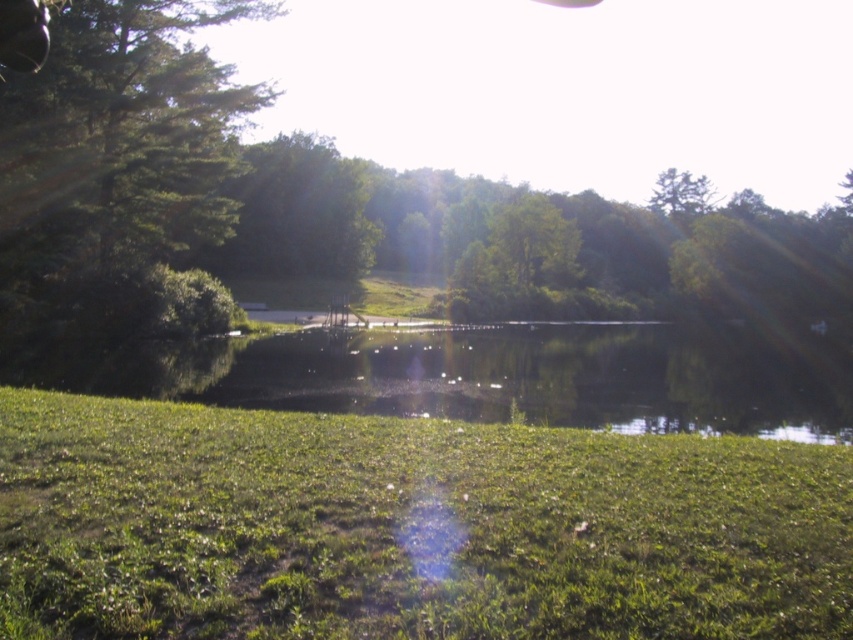
Question: Does green grassy at lower center appear on the right side of green leafy tree at upper left?

Choices:
 (A) yes
 (B) no

Answer: (A)

Question: Can you confirm if green grassy at lower center is wider than green leafy tree at upper left?

Choices:
 (A) no
 (B) yes

Answer: (A)

Question: In this image, where is green grassy at lower center located relative to green leafy tree at upper left?

Choices:
 (A) above
 (B) below

Answer: (B)

Question: Which of the following is the closest to the observer?

Choices:
 (A) (163, 17)
 (B) (723, 573)

Answer: (B)

Question: Which point is farther to the camera?

Choices:
 (A) green grassy at lower center
 (B) green leafy tree at upper left

Answer: (A)

Question: Which object appears farthest from the camera in this image?

Choices:
 (A) green grassy at lower center
 (B) green leafy tree at upper left

Answer: (A)